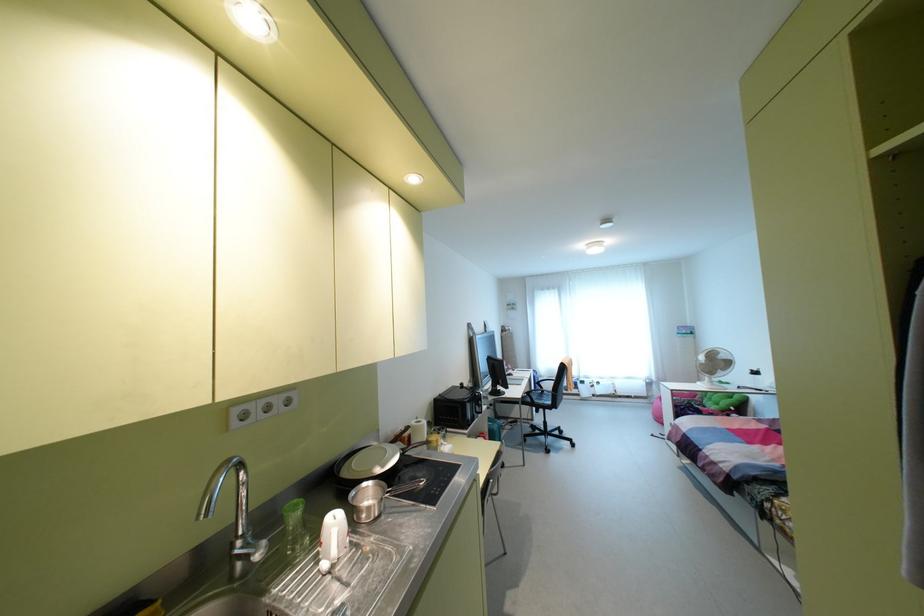
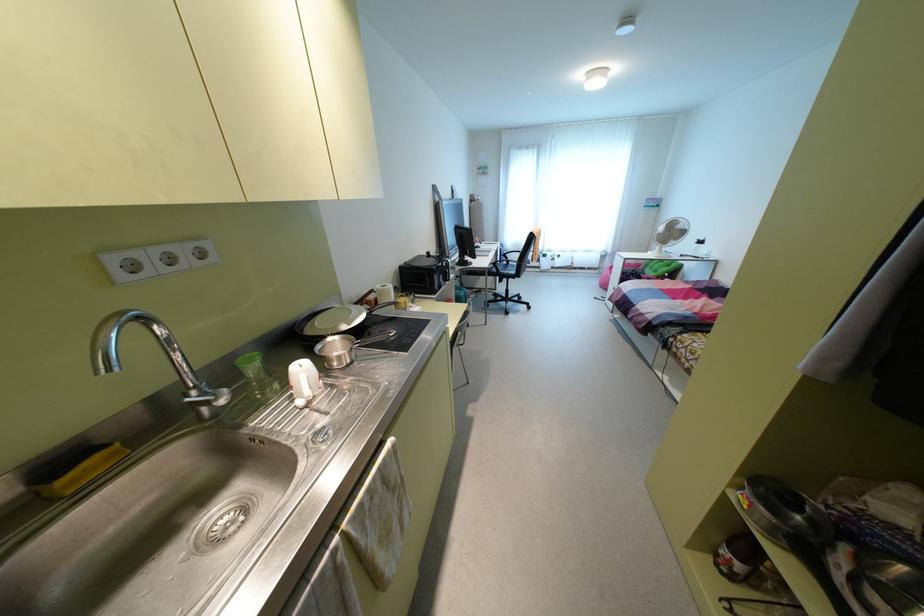
Locate, in the second image, the point that corresponds to point 722,355 in the first image.

(679, 225)